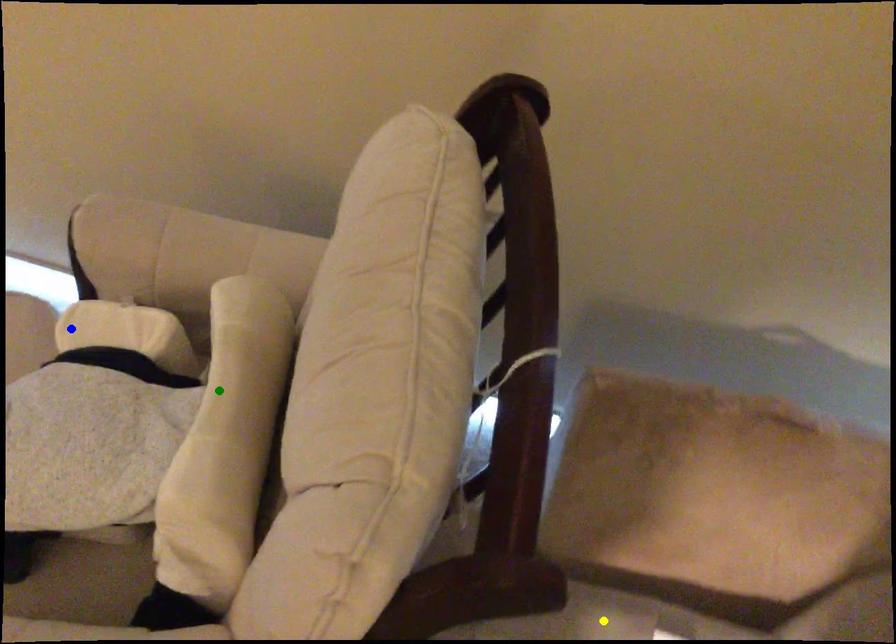
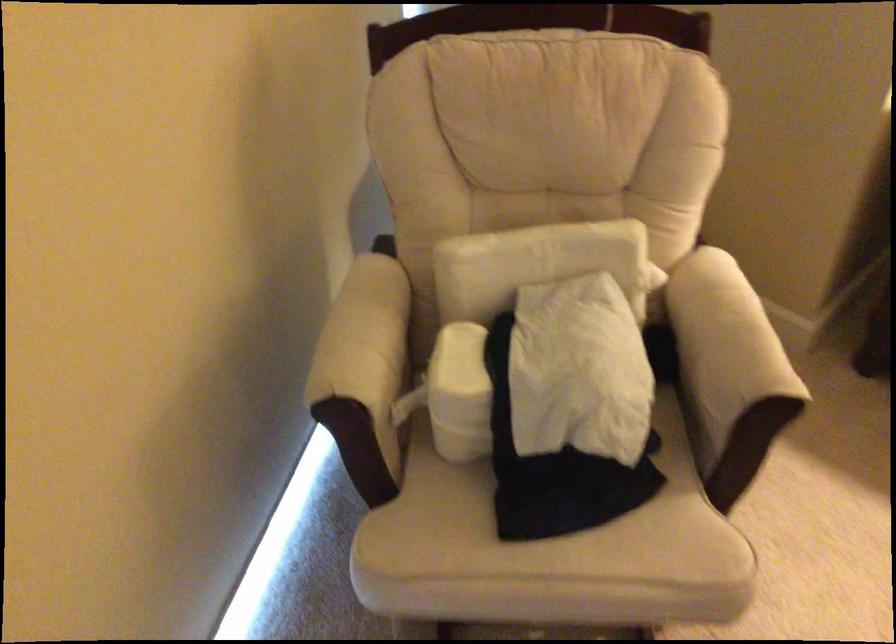
I am providing you with two images of the same scene from different viewpoints. Three points are marked in image1. Which point corresponds to a part or object that is occluded in image2?In image1, three points are marked. Which of them correspond to a part or object that is occluded in image2?Among the three points shown in image1, which one corresponds to a part or object that is no longer visible due to occlusion in image2?

yellow point cannot be seen in image2.